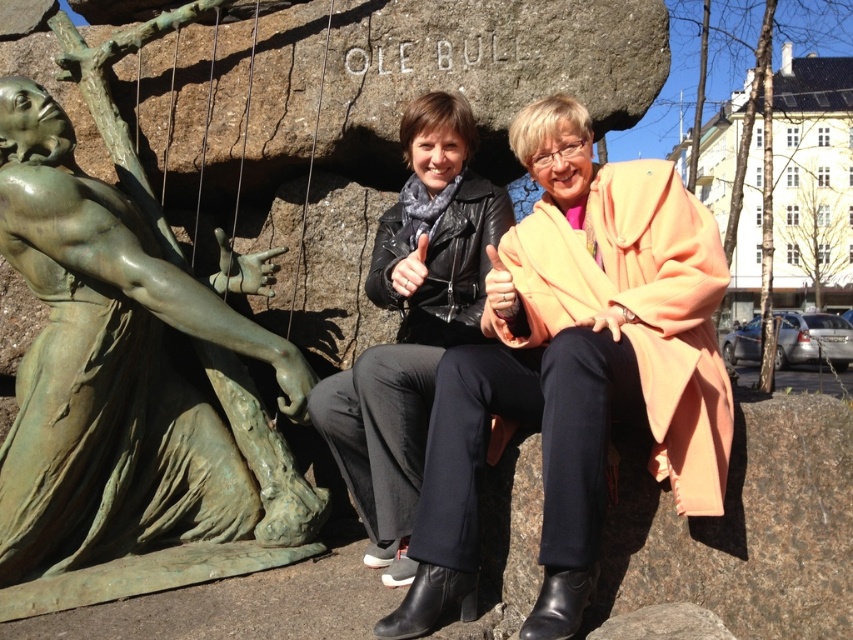
Can you confirm if matte black leather jacket at center is thinner than black leather jacket at center?

In fact, matte black leather jacket at center might be wider than black leather jacket at center.

Does matte black leather jacket at center have a smaller size compared to black leather jacket at center?

No.

Where is `matte black leather jacket at center`? Image resolution: width=853 pixels, height=640 pixels. matte black leather jacket at center is located at coordinates (575, 369).

In order to click on matte black leather jacket at center in this screenshot , I will do `click(575, 369)`.

Can you confirm if green patina bronze statue at left is smaller than black leather jacket at center?

No.

Is green patina bronze statue at left below black leather jacket at center?

Correct, green patina bronze statue at left is located below black leather jacket at center.

Identify the location of green patina bronze statue at left. (114, 385).

Is point (561, 547) positioned before point (99, 502)?

Yes, point (561, 547) is in front of point (99, 502).

The image size is (853, 640). What do you see at coordinates (575, 369) in the screenshot?
I see `matte black leather jacket at center` at bounding box center [575, 369].

What do you see at coordinates (575, 369) in the screenshot? This screenshot has width=853, height=640. I see `matte black leather jacket at center` at bounding box center [575, 369].

Image resolution: width=853 pixels, height=640 pixels. Identify the location of matte black leather jacket at center. (575, 369).